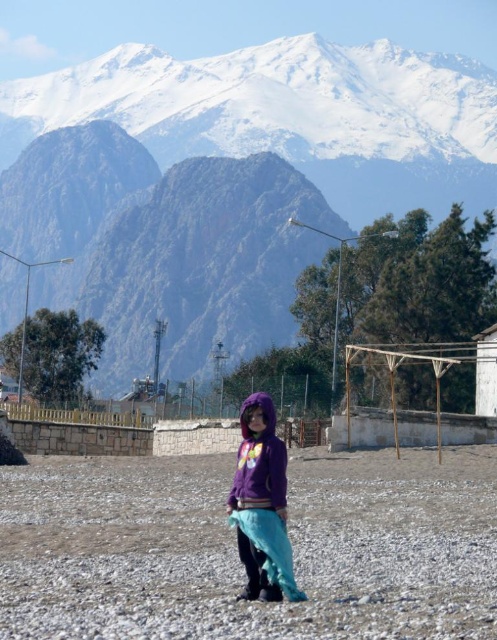
Question: Where is purple fleece hoodie at center located in relation to white painted wood hut at right in the image?

Choices:
 (A) below
 (B) above

Answer: (A)

Question: Where is snowy granite mountain range at upper center located in relation to purple fleece hoodie at center in the image?

Choices:
 (A) above
 (B) below

Answer: (A)

Question: Which of the following is the closest to the observer?

Choices:
 (A) (163, 124)
 (B) (120, 512)

Answer: (B)

Question: Which point is farther to the camera?

Choices:
 (A) (83, 566)
 (B) (479, 368)

Answer: (B)

Question: Does snowy granite mountain range at upper center lie in front of white painted wood hut at right?

Choices:
 (A) no
 (B) yes

Answer: (A)

Question: Which object is closer to the camera taking this photo?

Choices:
 (A) dusty gravel at center
 (B) snowy granite mountain range at upper center

Answer: (A)